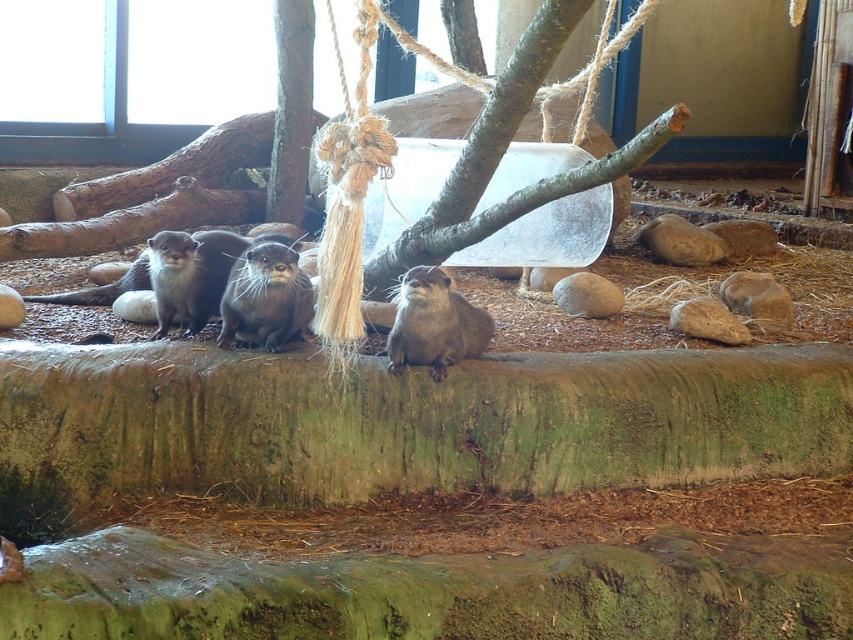
You are an otter keeper observing the enclosure from the front. You notice two specific points marked in the enclosure. Which point is closer to you, point (276, 323) or point (450, 333)?

Point (276, 323) is closer to you because it is further to the viewer than point (450, 333).

You are an animal caretaker observing the otters in their enclosure. You notice two otters at the center of the ledge. Which otter has a smaller width, the shiny brown otter at center or the soft brown fur otter at center?

The shiny brown otter at center has a smaller width compared to the soft brown fur otter at center.

You are an otter caretaker observing the enclosure. You notice two otters at the center of the ledge. Which otter would require more space to move comfortably, the shiny brown otter at center or the soft brown fur otter at center?

The shiny brown otter at center requires more space to move comfortably because it has a larger size compared to the soft brown fur otter at center.